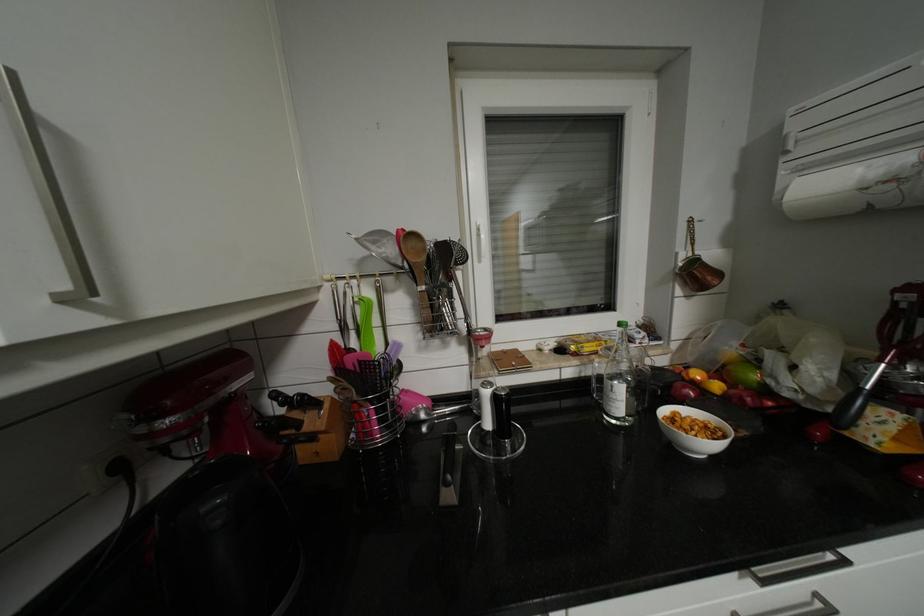
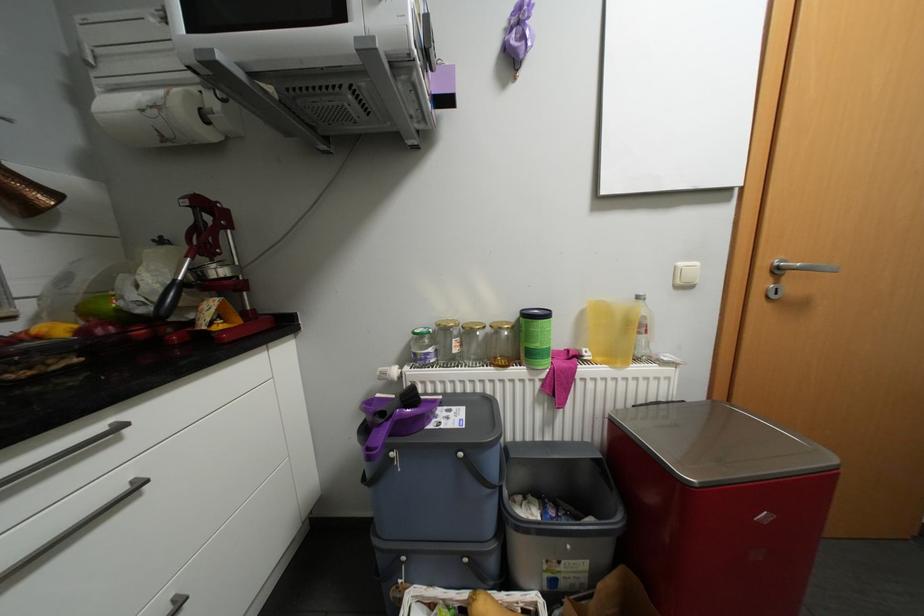
Question: The first image is from the beginning of the video and the second image is from the end. How did the camera likely rotate when shooting the video?

Choices:
 (A) Left
 (B) Right
 (C) Up
 (D) Down

Answer: (B)